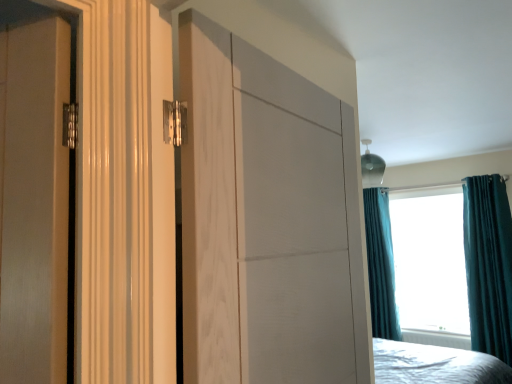
Question: Is teal velvet curtain at upper right not inside white plastic radiator at lower center?

Choices:
 (A) no
 (B) yes

Answer: (B)

Question: From the image's perspective, is teal velvet curtain at upper right beneath white plastic radiator at lower center?

Choices:
 (A) no
 (B) yes

Answer: (A)

Question: Can you confirm if teal velvet curtain at upper right is taller than white plastic radiator at lower center?

Choices:
 (A) no
 (B) yes

Answer: (B)

Question: Is teal velvet curtain at upper right thinner than white plastic radiator at lower center?

Choices:
 (A) no
 (B) yes

Answer: (A)

Question: Is teal velvet curtain at upper right closer to camera compared to white plastic radiator at lower center?

Choices:
 (A) yes
 (B) no

Answer: (B)

Question: Considering the relative positions of teal velvet curtain at upper right and white plastic radiator at lower center in the image provided, is teal velvet curtain at upper right to the right of white plastic radiator at lower center from the viewer's perspective?

Choices:
 (A) yes
 (B) no

Answer: (A)

Question: Does teal velvet curtain at right, the 2th curtain viewed from the right, have a lesser width compared to white plastic radiator at lower center?

Choices:
 (A) yes
 (B) no

Answer: (B)

Question: Is white plastic radiator at lower center at the back of teal velvet curtain at right, which is counted as the first curtain, starting from the left?

Choices:
 (A) no
 (B) yes

Answer: (A)

Question: From a real-world perspective, is teal velvet curtain at right, the 1th curtain positioned from the back, positioned over white plastic radiator at lower center based on gravity?

Choices:
 (A) no
 (B) yes

Answer: (B)

Question: Is the depth of teal velvet curtain at right, the 1th curtain positioned from the back, greater than that of white plastic radiator at lower center?

Choices:
 (A) no
 (B) yes

Answer: (B)

Question: Is white plastic radiator at lower center located within teal velvet curtain at right, which is counted as the first curtain, starting from the left?

Choices:
 (A) yes
 (B) no

Answer: (B)

Question: Is teal velvet curtain at right, which is counted as the first curtain, starting from the left, positioned beyond the bounds of white plastic radiator at lower center?

Choices:
 (A) yes
 (B) no

Answer: (A)

Question: Considering the relative sizes of white plastic radiator at lower center and white wood door at center in the image provided, is white plastic radiator at lower center wider than white wood door at center?

Choices:
 (A) no
 (B) yes

Answer: (A)